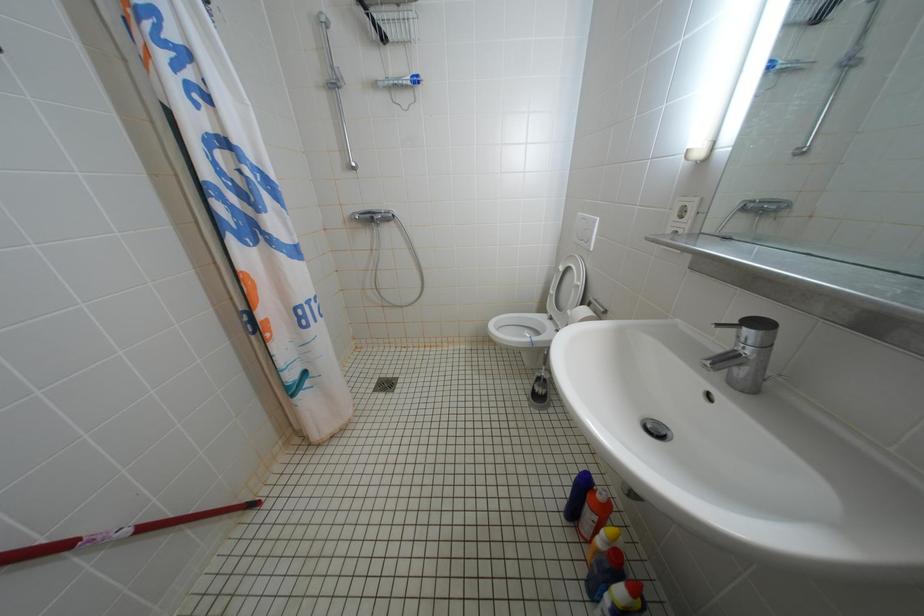
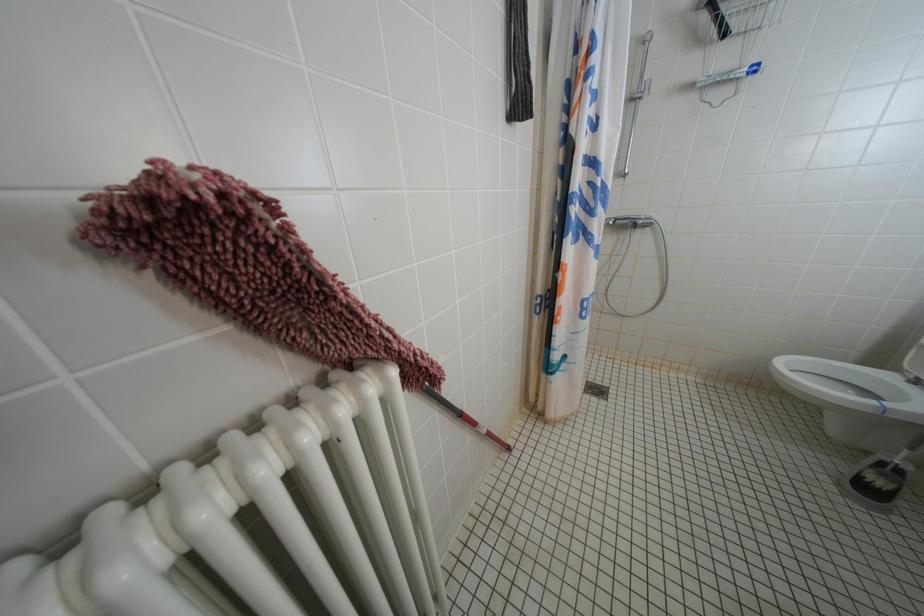
Question: The first image is from the beginning of the video and the second image is from the end. How did the camera likely rotate when shooting the video?

Choices:
 (A) Left
 (B) Right
 (C) Up
 (D) Down

Answer: (A)